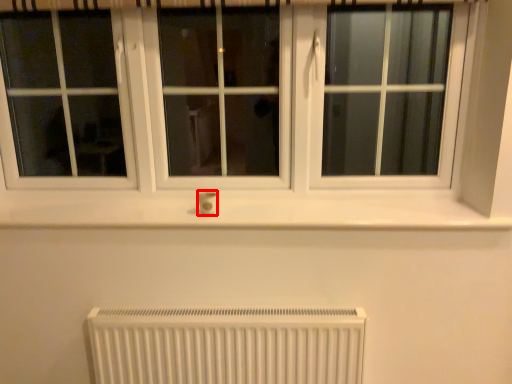
Question: From the image's perspective, what is the correct spatial positioning of electric outlet (annotated by the red box) in reference to radiator?

Choices:
 (A) below
 (B) above

Answer: (B)